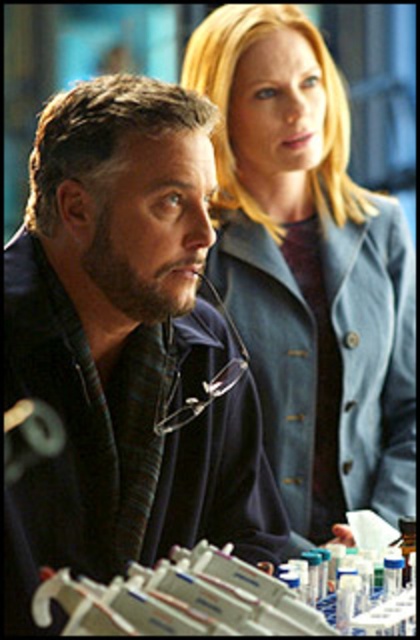
Looking at this image, who is more distant from viewer, (154, 99) or (199, 38)?

The point (199, 38) is more distant.

Does point (57, 132) come closer to viewer compared to point (336, 102)?

That is True.

Where is `dark blue textured jacket at center`? Image resolution: width=420 pixels, height=640 pixels. dark blue textured jacket at center is located at coordinates (125, 346).

Image resolution: width=420 pixels, height=640 pixels. Identify the location of dark blue textured jacket at center. (125, 346).